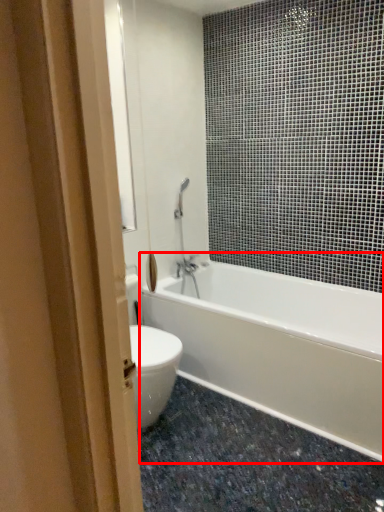
Question: From the image's perspective, what is the correct spatial relationship of bathtub (annotated by the red box) in relation to granite?

Choices:
 (A) above
 (B) below

Answer: (A)